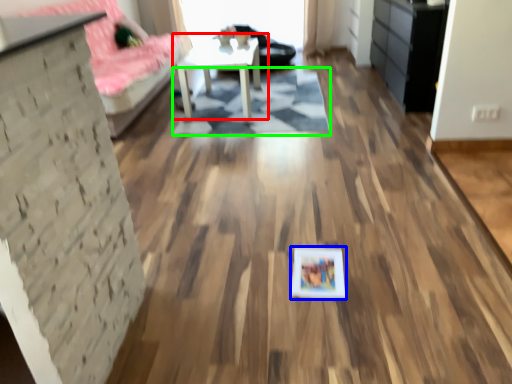
Question: Which object is the farthest from table (highlighted by a red box)? Choose among these: picture frame (highlighted by a blue box) or mat (highlighted by a green box).

Choices:
 (A) picture frame
 (B) mat

Answer: (A)